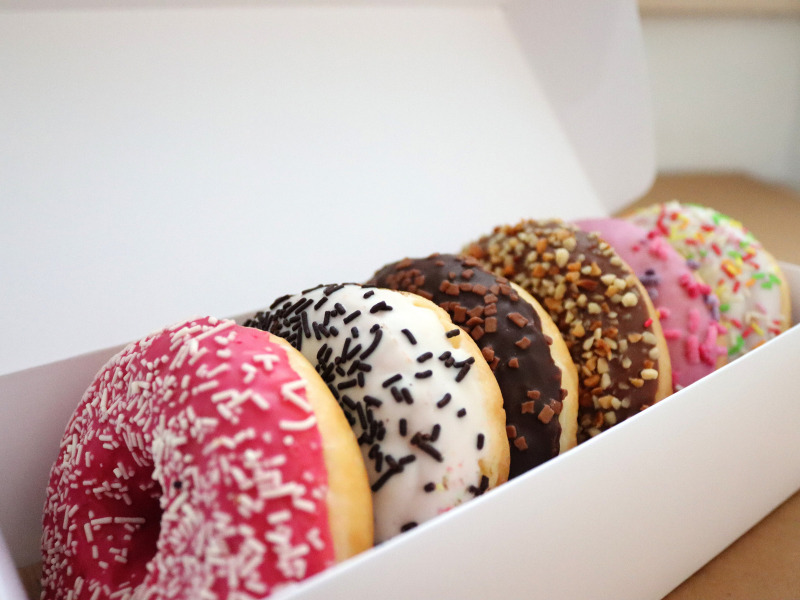
This screenshot has height=600, width=800. In order to click on white wall in this screenshot , I will do `click(720, 83)`.